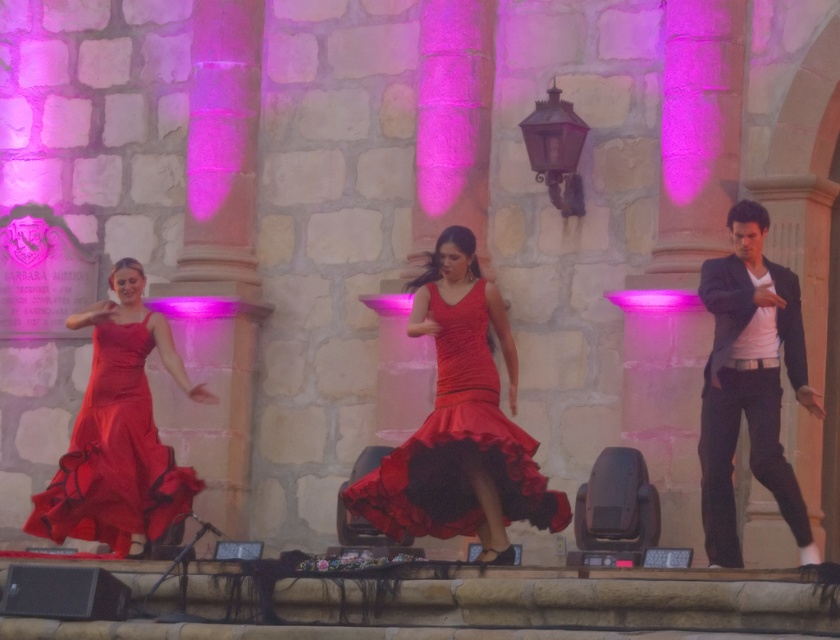
Can you confirm if satin dress at center is taller than satin red dress at left?

Correct, satin dress at center is much taller as satin red dress at left.

Is satin dress at center to the left of satin red dress at left from the viewer's perspective?

Incorrect, satin dress at center is not on the left side of satin red dress at left.

Does point (549, 500) lie behind point (123, 442)?

No, (549, 500) is in front of (123, 442).

Locate an element on the screen. satin dress at center is located at coordinates (458, 444).

Does dark gray suit at right lie behind satin red dress at left?

No, dark gray suit at right is closer to the viewer.

Can you confirm if dark gray suit at right is smaller than satin red dress at left?

Incorrect, dark gray suit at right is not smaller in size than satin red dress at left.

Who is more forward, (701, 428) or (124, 493)?

Point (701, 428) is in front.

Find the location of a particular element. Image resolution: width=840 pixels, height=640 pixels. dark gray suit at right is located at coordinates (749, 384).

Can you confirm if dark gray suit at right is positioned to the right of satin dress at center?

Yes, dark gray suit at right is to the right of satin dress at center.

Where is `dark gray suit at right`? dark gray suit at right is located at coordinates (749, 384).